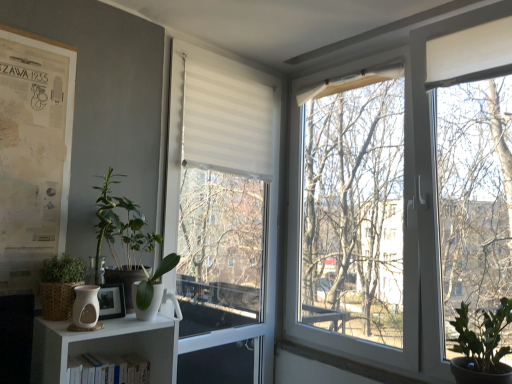
Question: Can you confirm if green matte plant at left, which is counted as the second vegetation, starting from the left, is smaller than wooden picture frame at lower left?

Choices:
 (A) yes
 (B) no

Answer: (B)

Question: Can you confirm if green matte plant at left, which is counted as the second vegetation, starting from the left, is taller than wooden picture frame at lower left?

Choices:
 (A) yes
 (B) no

Answer: (A)

Question: Are green matte plant at left, which is counted as the second vegetation, starting from the right, and wooden picture frame at lower left located far from each other?

Choices:
 (A) no
 (B) yes

Answer: (A)

Question: Is green matte plant at left, which is counted as the second vegetation, starting from the left, bigger than wooden picture frame at lower left?

Choices:
 (A) yes
 (B) no

Answer: (A)

Question: Is green matte plant at left, which is counted as the second vegetation, starting from the right, thinner than wooden picture frame at lower left?

Choices:
 (A) no
 (B) yes

Answer: (A)

Question: From a real-world perspective, is green matte plant at left, which is counted as the second vegetation, starting from the left, physically below wooden picture frame at lower left?

Choices:
 (A) no
 (B) yes

Answer: (A)

Question: From the image's perspective, is white paperboard poster at left below white matte window at center?

Choices:
 (A) no
 (B) yes

Answer: (A)

Question: Can you confirm if white paperboard poster at left is shorter than white matte window at center?

Choices:
 (A) yes
 (B) no

Answer: (A)

Question: Is white matte window at center a part of white paperboard poster at left?

Choices:
 (A) no
 (B) yes

Answer: (A)

Question: Is white paperboard poster at left at the left side of white matte window at center?

Choices:
 (A) yes
 (B) no

Answer: (A)

Question: Is white paperboard poster at left turned away from white matte window at center?

Choices:
 (A) yes
 (B) no

Answer: (B)

Question: From a real-world perspective, is white paperboard poster at left located higher than white matte window at center?

Choices:
 (A) yes
 (B) no

Answer: (A)

Question: Can you see green matte plant at lower right, the third vegetation positioned from the left, touching matte white vase at lower left?

Choices:
 (A) no
 (B) yes

Answer: (A)